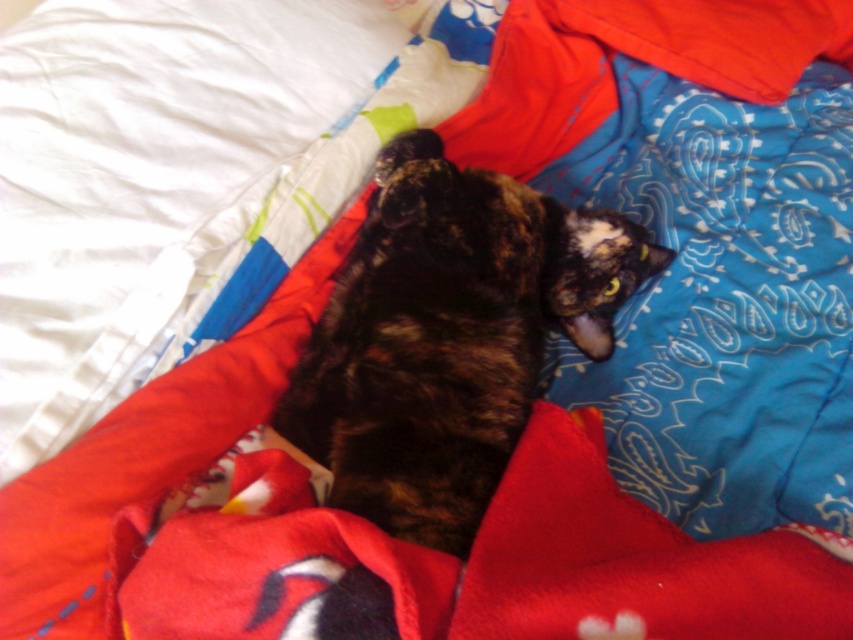
Question: Can you confirm if white soft pillow at upper left is bigger than shiny tortoiseshell cat at center?

Choices:
 (A) no
 (B) yes

Answer: (B)

Question: Which of the following is the farthest from the observer?

Choices:
 (A) (28, 97)
 (B) (432, 333)

Answer: (A)

Question: Can you confirm if white soft pillow at upper left is wider than shiny tortoiseshell cat at center?

Choices:
 (A) yes
 (B) no

Answer: (A)

Question: Observing the image, what is the correct spatial positioning of white soft pillow at upper left in reference to shiny tortoiseshell cat at center?

Choices:
 (A) left
 (B) right

Answer: (A)